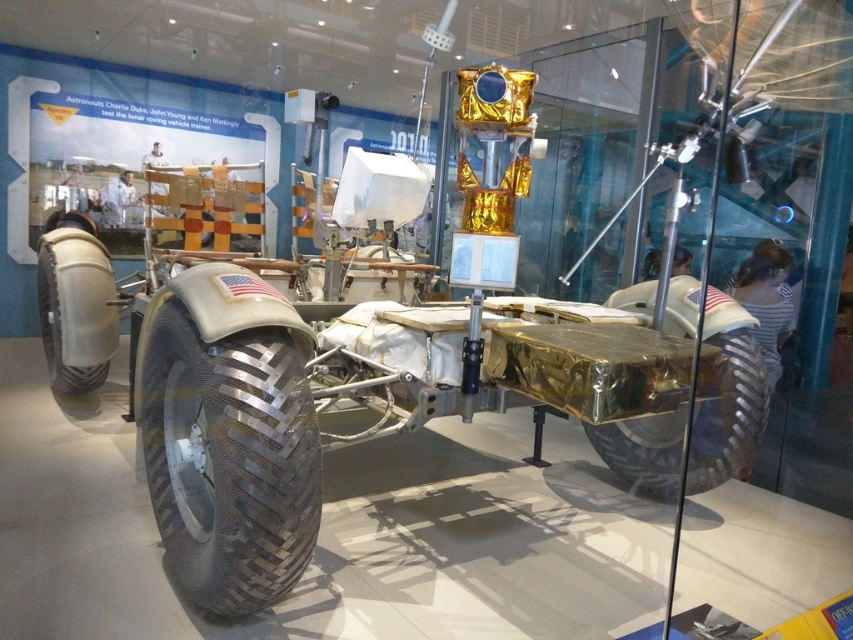
In the scene shown: You are a museum guide explaining the lunar rover to a visitor. The visitor asks if the metallic silver tire at lower left is positioned closer to the top or bottom of the image. How do you answer?

The metallic silver tire at lower left is located at point 0.270 on the vertical axis, which means it is closer to the bottom of the image.

You are a museum visitor standing in front of the lunar rover exhibit. You notice the metallic silver tire at lower left and the shiny metallic tire at lower right. Which of these two tires is positioned more to the left side of the exhibit?

The metallic silver tire at lower left is positioned more to the left side of the exhibit than the shiny metallic tire at lower right.